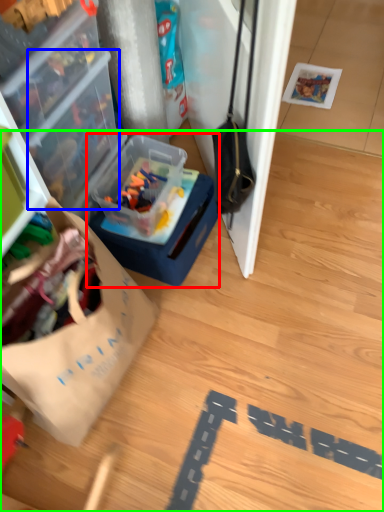
Question: Which object is the farthest from box (highlighted by a red box)? Choose among these: box (highlighted by a blue box) or wood (highlighted by a green box).

Choices:
 (A) box
 (B) wood

Answer: (B)